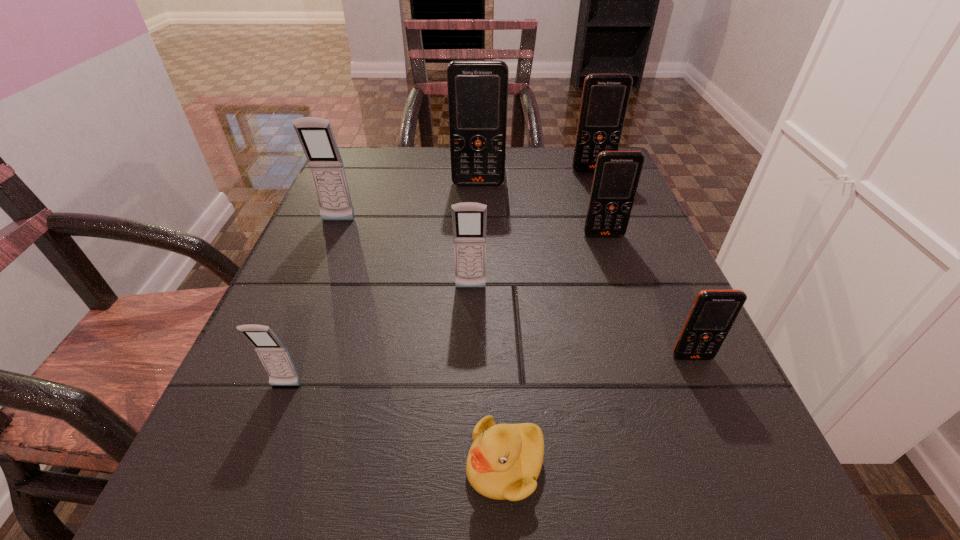
Where is `the tallest cellular telephone`? The image size is (960, 540). the tallest cellular telephone is located at coordinates (477, 90).

Find the location of a particular element. Image resolution: width=960 pixels, height=540 pixels. the second farthest object is located at coordinates (477, 90).

Identify the location of the third farthest object. The width and height of the screenshot is (960, 540). (315, 134).

At what (x,y) coordinates should I click in order to perform the action: click on the biggest gray cellular telephone. Please return your answer as a coordinate pair (x, y). The width and height of the screenshot is (960, 540). Looking at the image, I should click on (315, 134).

The height and width of the screenshot is (540, 960). Find the location of `the farthest object`. the farthest object is located at coordinates (605, 97).

The image size is (960, 540). Identify the location of the farthest orange cellular telephone. (605, 97).

At what (x,y) coordinates should I click in order to perform the action: click on the fifth farthest object. Please return your answer as a coordinate pair (x, y). This screenshot has height=540, width=960. Looking at the image, I should click on (469, 218).

Identify the location of the second smallest gray cellular telephone. This screenshot has width=960, height=540. (469, 218).

Find the location of a particular element. This screenshot has height=540, width=960. the second nearest orange cellular telephone is located at coordinates (617, 173).

Find the location of a particular element. the third biggest orange cellular telephone is located at coordinates (x=617, y=173).